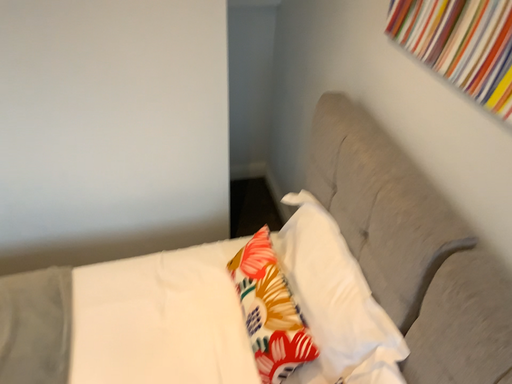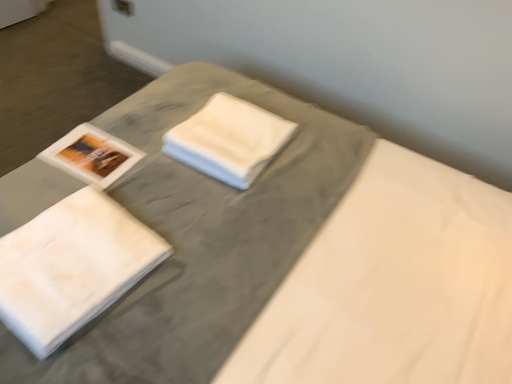
Question: How did the camera likely rotate when shooting the video?

Choices:
 (A) rotated right
 (B) rotated left

Answer: (B)